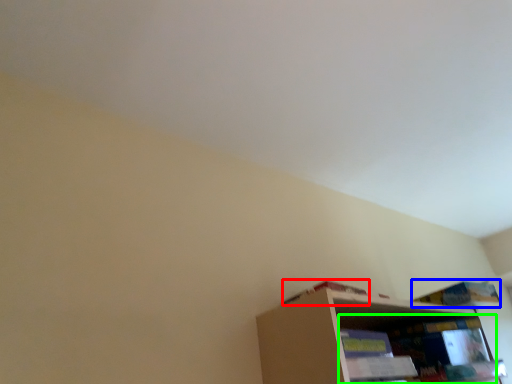
Question: Considering the real-world distances, which object is farthest from book (highlighted by a red box)? book (highlighted by a blue box) or shelf (highlighted by a green box)?

Choices:
 (A) book
 (B) shelf

Answer: (A)